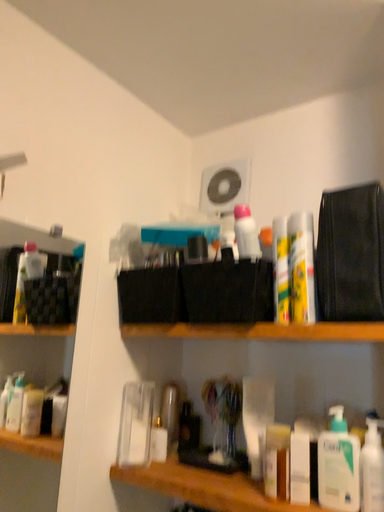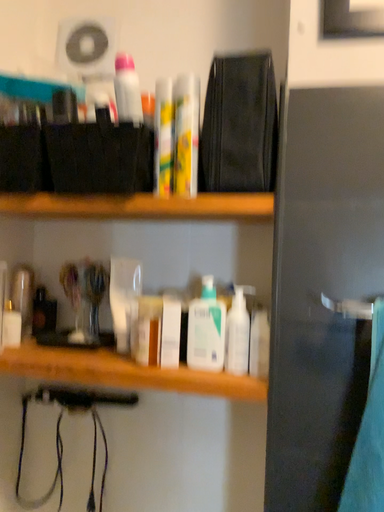
Question: Which way did the camera rotate in the video?

Choices:
 (A) rotated upward
 (B) rotated downward

Answer: (B)